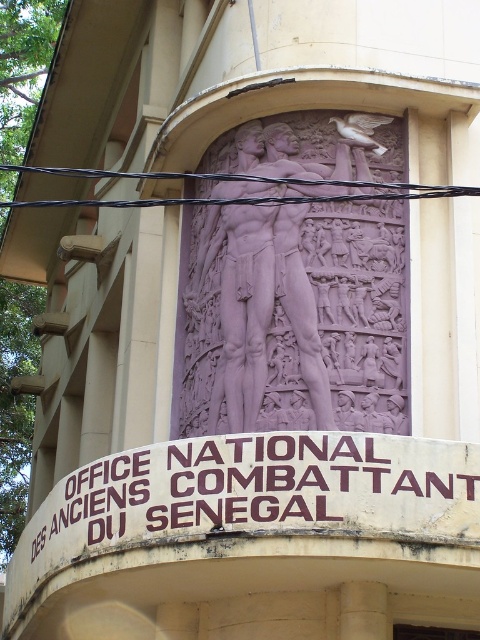
In the scene shown: Which is more to the right, purple stone relief at center or brownmaterial/texturesign at center?

purple stone relief at center is more to the right.

Between purple stone relief at center and brownmaterial/texturesign at center, which one is positioned lower?

Positioned lower is brownmaterial/texturesign at center.

Where is `purple stone relief at center`? The width and height of the screenshot is (480, 640). purple stone relief at center is located at coordinates (291, 314).